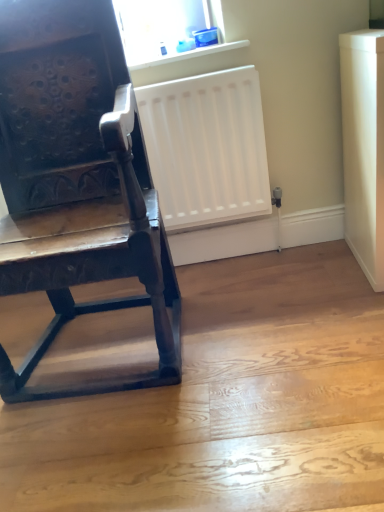
Question: In which direction should I rotate to look at transparent plastic container at upper center?

Choices:
 (A) right
 (B) left

Answer: (B)

Question: Does transparent plastic container at upper center have a greater height compared to dark wood chair at left?

Choices:
 (A) no
 (B) yes

Answer: (A)

Question: Would you say dark wood chair at left is part of transparent plastic container at upper center's contents?

Choices:
 (A) no
 (B) yes

Answer: (A)

Question: Does transparent plastic container at upper center appear on the right side of dark wood chair at left?

Choices:
 (A) no
 (B) yes

Answer: (B)

Question: Is transparent plastic container at upper center not inside dark wood chair at left?

Choices:
 (A) no
 (B) yes

Answer: (B)

Question: Does transparent plastic container at upper center appear on the left side of dark wood chair at left?

Choices:
 (A) no
 (B) yes

Answer: (A)

Question: From the image's perspective, would you say transparent plastic container at upper center is shown under dark wood chair at left?

Choices:
 (A) no
 (B) yes

Answer: (A)

Question: Considering the relative sizes of white plastic window sill at upper center and dark wood chair at left in the image provided, is white plastic window sill at upper center smaller than dark wood chair at left?

Choices:
 (A) no
 (B) yes

Answer: (B)

Question: Does white plastic window sill at upper center have a greater width compared to dark wood chair at left?

Choices:
 (A) yes
 (B) no

Answer: (B)

Question: From the image's perspective, does white plastic window sill at upper center appear higher than dark wood chair at left?

Choices:
 (A) no
 (B) yes

Answer: (B)

Question: Is white plastic window sill at upper center further to the viewer compared to dark wood chair at left?

Choices:
 (A) no
 (B) yes

Answer: (B)

Question: From the image's perspective, would you say white plastic window sill at upper center is shown under dark wood chair at left?

Choices:
 (A) no
 (B) yes

Answer: (A)

Question: Is white plastic window sill at upper center oriented towards dark wood chair at left?

Choices:
 (A) yes
 (B) no

Answer: (B)

Question: Can you confirm if dark wood chair at left is thinner than transparent plastic container at upper center?

Choices:
 (A) no
 (B) yes

Answer: (A)